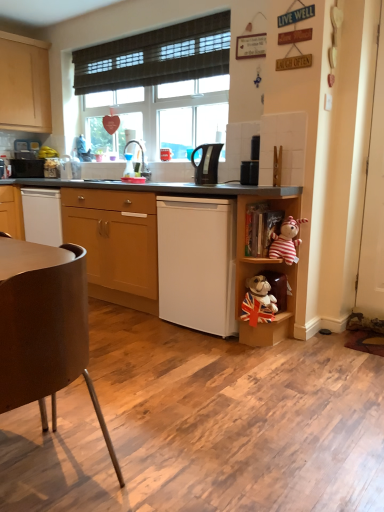
Question: Should I look upward or downward to see wooden bookshelf at center-right, the 3th shelf positioned from the bottom?

Choices:
 (A) down
 (B) up

Answer: (B)

Question: Considering the relative sizes of brown matte chair at lower left and black plastic speaker at center, marked as the 3th appliance in a left-to-right arrangement, in the image provided, is brown matte chair at lower left shorter than black plastic speaker at center, marked as the 3th appliance in a left-to-right arrangement,?

Choices:
 (A) no
 (B) yes

Answer: (A)

Question: Considering the relative positions of brown matte chair at lower left and black plastic speaker at center, which is the 1th appliance in front-to-back order, in the image provided, is brown matte chair at lower left to the left of black plastic speaker at center, which is the 1th appliance in front-to-back order, from the viewer's perspective?

Choices:
 (A) yes
 (B) no

Answer: (A)

Question: Is brown matte chair at lower left with black plastic speaker at center, marked as the 3th appliance in a left-to-right arrangement?

Choices:
 (A) yes
 (B) no

Answer: (B)

Question: Is brown matte chair at lower left outside of black plastic speaker at center, which is the 1th appliance in front-to-back order?

Choices:
 (A) no
 (B) yes

Answer: (B)

Question: Is brown matte chair at lower left thinner than black plastic speaker at center, the first appliance from the right?

Choices:
 (A) yes
 (B) no

Answer: (B)

Question: Considering the relative sizes of brown matte chair at lower left and black plastic speaker at center, the first appliance from the right, in the image provided, is brown matte chair at lower left taller than black plastic speaker at center, the first appliance from the right,?

Choices:
 (A) yes
 (B) no

Answer: (A)

Question: Is brown matte chair at lower left in front of black plastic kettle at center?

Choices:
 (A) yes
 (B) no

Answer: (A)

Question: Is brown matte chair at lower left to the right of black plastic kettle at center from the viewer's perspective?

Choices:
 (A) yes
 (B) no

Answer: (B)

Question: Does brown matte chair at lower left have a larger size compared to black plastic kettle at center?

Choices:
 (A) yes
 (B) no

Answer: (A)

Question: From a real-world perspective, is brown matte chair at lower left physically above black plastic kettle at center?

Choices:
 (A) no
 (B) yes

Answer: (A)

Question: Is brown matte chair at lower left oriented towards black plastic kettle at center?

Choices:
 (A) yes
 (B) no

Answer: (A)

Question: Is the surface of brown matte chair at lower left in direct contact with black plastic kettle at center?

Choices:
 (A) yes
 (B) no

Answer: (B)

Question: Is white plastic shelf at lower right, marked as the first shelf in a bottom-to-top arrangement, aimed at striped fabric monkey at right?

Choices:
 (A) yes
 (B) no

Answer: (B)